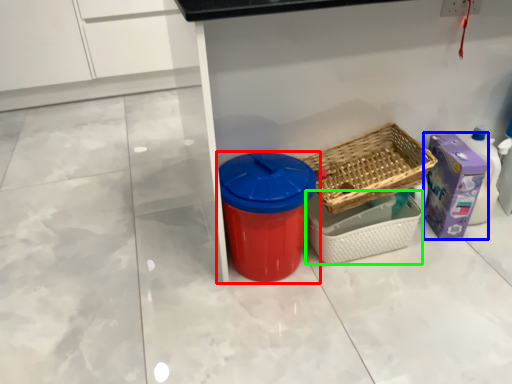
Question: Considering the real-world distances, which object is closest to waste container (highlighted by a red box)? storage box (highlighted by a blue box) or basket (highlighted by a green box).

Choices:
 (A) storage box
 (B) basket

Answer: (B)